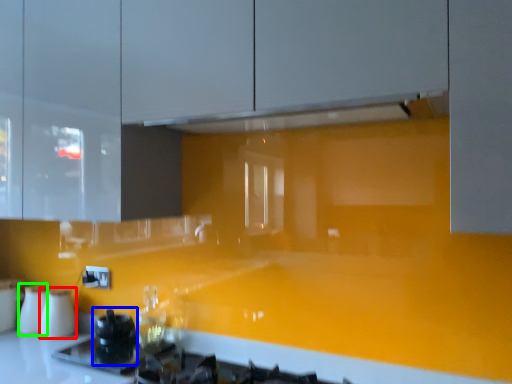
Question: Based on their relative distances, which object is farther from appliance (highlighted by a red box)? Choose from appliance (highlighted by a blue box) and appliance (highlighted by a green box).

Choices:
 (A) appliance
 (B) appliance

Answer: (A)